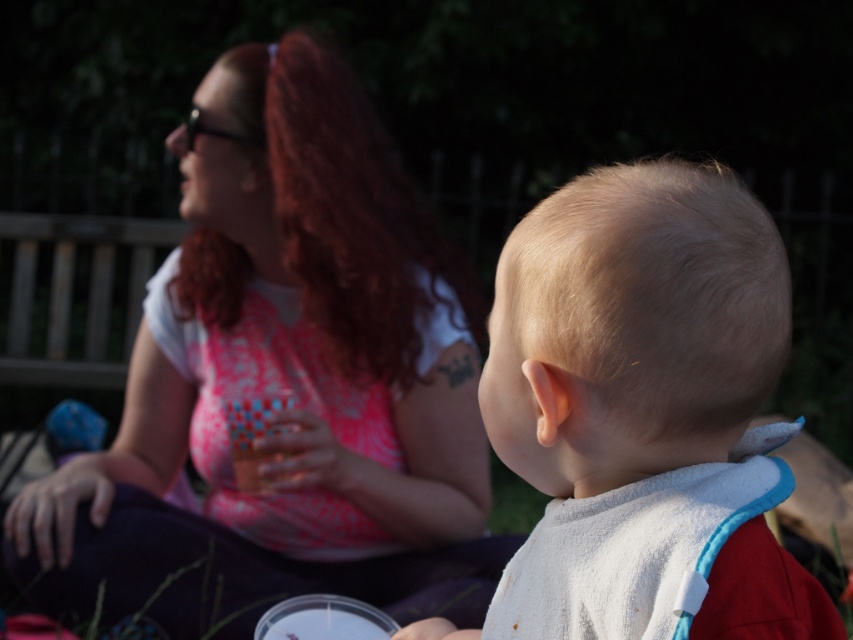
You are standing at the camera position and want to throw a ball to the point marked as point (296, 483). What is the minimum distance you need to throw the ball?

The minimum distance you need to throw the ball is 2.16 meters because the point (296, 483) is 2.16 meters away from the camera.

You are a photographer trying to capture a candid shot of the blonde hair at center and the pink printed fabric at upper left. Which object should you focus on first if you want to start with the one closer to the camera?

The pink printed fabric at upper left is located below blonde hair at center, meaning it is closer to the camera. Therefore, you should focus on the pink printed fabric at upper left first.

You are a photographer trying to capture a portrait of the two people in the scene. You notice the pink printed fabric at upper left and the blonde hair at center. Which object should you avoid placing in the center of your frame to keep the focus on the subjects?

You should avoid placing the pink printed fabric at upper left in the center of your frame because it is positioned on the left side of the blonde hair at center, which is closer to the main subjects.